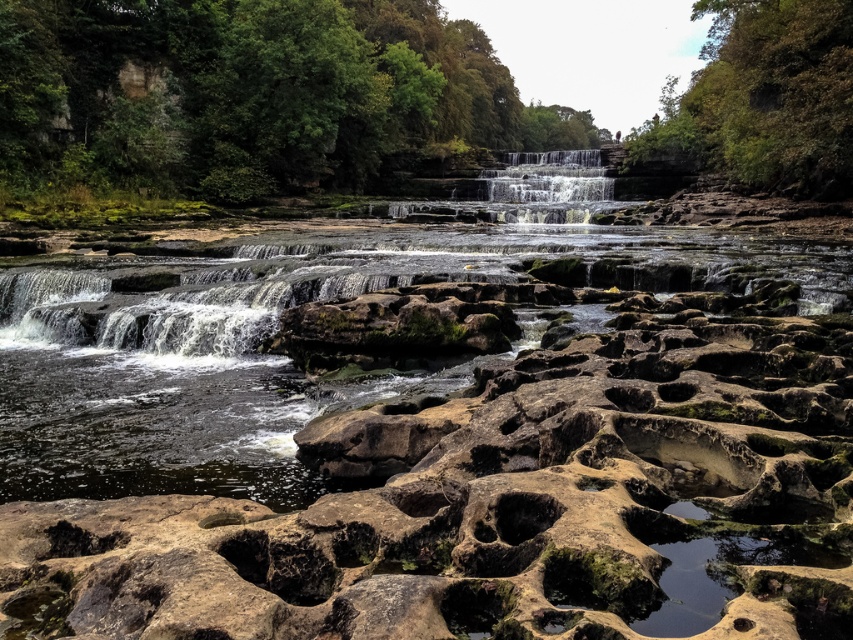
Describe the element at coordinates (271, 333) in the screenshot. I see `brown rock river at center` at that location.

Is brown rock river at center further to camera compared to smooth stone waterfall at center?

Result: No, it is not.

Where is `brown rock river at center`? brown rock river at center is located at coordinates (271, 333).

What are the coordinates of `brown rock river at center` in the screenshot? It's located at (271, 333).

Can you confirm if brown rock river at center is positioned to the left of green leafy tree at upper center?

Yes, brown rock river at center is to the left of green leafy tree at upper center.

Does brown rock river at center come behind green leafy tree at upper center?

No, brown rock river at center is in front of green leafy tree at upper center.

The height and width of the screenshot is (640, 853). I want to click on brown rock river at center, so click(271, 333).

Does green leafy tree at upper center appear on the right side of smooth stone waterfall at center?

Indeed, green leafy tree at upper center is positioned on the right side of smooth stone waterfall at center.

Between green leafy tree at upper center and smooth stone waterfall at center, which one appears on the right side from the viewer's perspective?

green leafy tree at upper center

Does point (425, 35) lie in front of point (566, 218)?

No, (425, 35) is behind (566, 218).

At what (x,y) coordinates should I click in order to perform the action: click on green leafy tree at upper center. Please return your answer as a coordinate pair (x, y). This screenshot has height=640, width=853. Looking at the image, I should click on (250, 93).